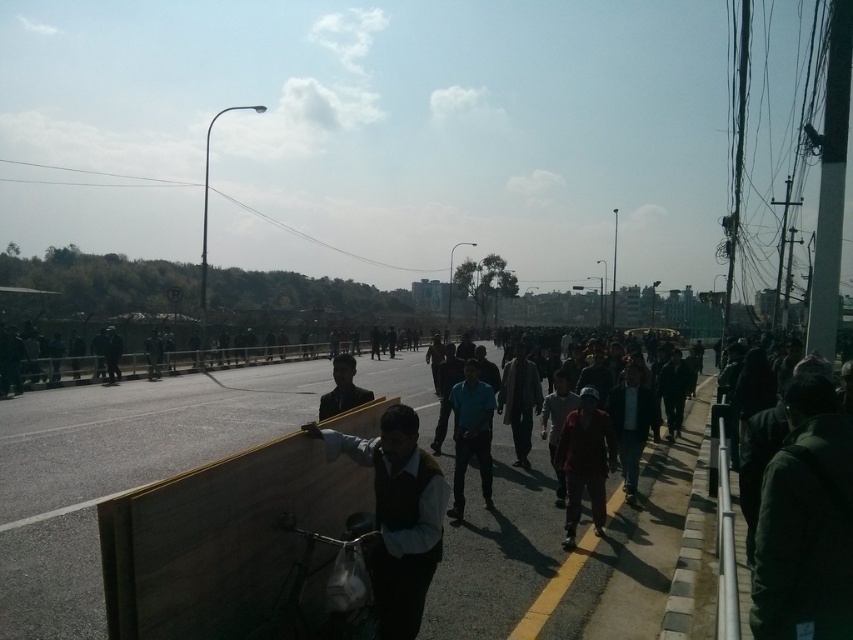
You are a pedestrian trying to cross the road in the scene. There is a wooden plank at center and a dark green jacket at lower right. Which object is closer to the road?

The wooden plank at center is positioned under dark green jacket at lower right, meaning the wooden plank is closer to the road than the dark green jacket at lower right.